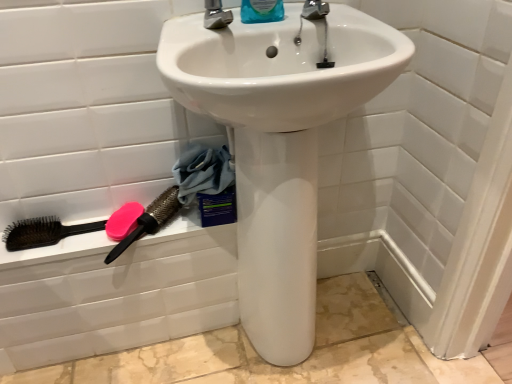
Question: Considering the relative sizes of brown bristle brush at lower left, which is counted as the third brush, starting from the right, and pink rubber brush at lower left, which appears as the 1th brush when viewed from the right, in the image provided, is brown bristle brush at lower left, which is counted as the third brush, starting from the right, thinner than pink rubber brush at lower left, which appears as the 1th brush when viewed from the right,?

Choices:
 (A) yes
 (B) no

Answer: (A)

Question: Can you confirm if brown bristle brush at lower left, the 1th brush in the left-to-right sequence, is positioned to the left of pink rubber brush at lower left, acting as the 3th brush starting from the left?

Choices:
 (A) no
 (B) yes

Answer: (B)

Question: Can you confirm if brown bristle brush at lower left, the 1th brush in the left-to-right sequence, is wider than pink rubber brush at lower left, which appears as the 1th brush when viewed from the right?

Choices:
 (A) no
 (B) yes

Answer: (A)

Question: Can you confirm if brown bristle brush at lower left, which is counted as the third brush, starting from the right, is bigger than pink rubber brush at lower left, which appears as the 1th brush when viewed from the right?

Choices:
 (A) no
 (B) yes

Answer: (A)

Question: Is pink rubber brush at lower left, acting as the 3th brush starting from the left, a part of brown bristle brush at lower left, which is counted as the third brush, starting from the right?

Choices:
 (A) no
 (B) yes

Answer: (A)

Question: Is pink matte soap at lower left situated inside blue fabric at lower left or outside?

Choices:
 (A) inside
 (B) outside

Answer: (B)

Question: From a real-world perspective, is pink matte soap at lower left positioned above or below blue fabric at lower left?

Choices:
 (A) below
 (B) above

Answer: (A)

Question: Considering the positions of pink matte soap at lower left and blue fabric at lower left in the image, is pink matte soap at lower left wider or thinner than blue fabric at lower left?

Choices:
 (A) thin
 (B) wide

Answer: (B)

Question: Considering their positions, is pink matte soap at lower left located in front of or behind blue fabric at lower left?

Choices:
 (A) behind
 (B) front

Answer: (A)

Question: From the image's perspective, is pink rubber brush at lower left, acting as the 3th brush starting from the left, above or below pink matte soap at lower left?

Choices:
 (A) below
 (B) above

Answer: (B)

Question: Is pink rubber brush at lower left, acting as the 3th brush starting from the left, taller or shorter than pink matte soap at lower left?

Choices:
 (A) short
 (B) tall

Answer: (B)

Question: From a real-world perspective, is pink rubber brush at lower left, acting as the 3th brush starting from the left, above or below pink matte soap at lower left?

Choices:
 (A) below
 (B) above

Answer: (B)

Question: Considering their positions, is pink rubber brush at lower left, acting as the 3th brush starting from the left, located in front of or behind pink matte soap at lower left?

Choices:
 (A) behind
 (B) front

Answer: (B)

Question: Would you say blue plastic bottle at upper center is to the left or to the right of white glossy sink at center in the picture?

Choices:
 (A) right
 (B) left

Answer: (B)

Question: Is point (260, 1) closer or farther from the camera than point (296, 201)?

Choices:
 (A) closer
 (B) farther

Answer: (B)